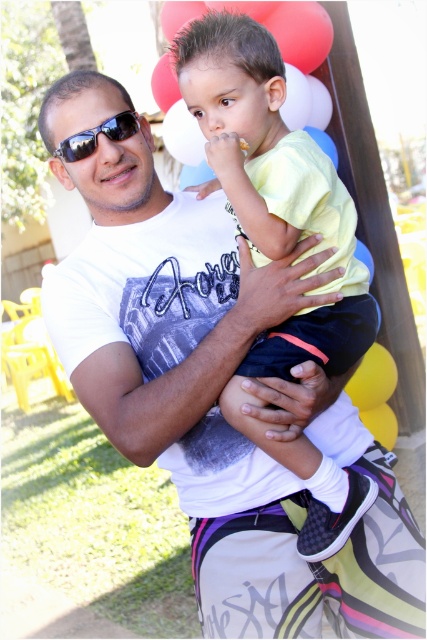
In the image, there is a point labeled at coordinates [373,378]. Based on the scene description, what object is located at this point?

The point at coordinates [373,378] corresponds to the yellow matte balloon at center.

Consider the image. You are planning to take a photo of the red matte balloon at upper center and the white matte balloon at upper center. Which balloon should you focus on if you want to capture the taller one?

The white matte balloon at upper center is taller than the red matte balloon at upper center, so you should focus on the white matte balloon at upper center to capture the taller one.

You are at a party and want to know the arrangement of the balloons behind the adult. Which balloon is positioned to the right when looking at the red matte balloon at upper center and the white matte balloon at upper center?

The red matte balloon at upper center is positioned to the right of the white matte balloon at upper center.